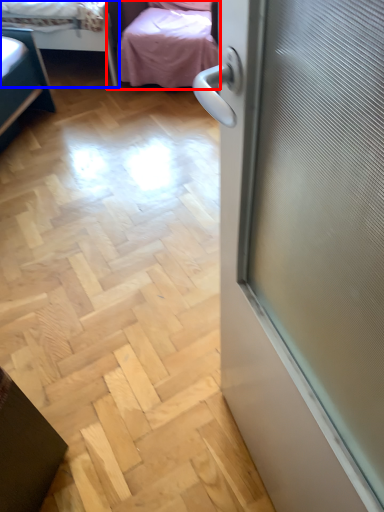
Question: Among these objects, which one is nearest to the camera, studio couch (highlighted by a red box) or bed (highlighted by a blue box)?

Choices:
 (A) studio couch
 (B) bed

Answer: (A)